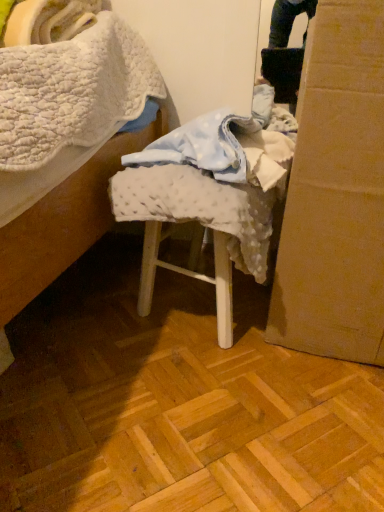
Question: Considering the relative positions of cardboard box at right and white dotted fabric at center in the image provided, is cardboard box at right behind white dotted fabric at center?

Choices:
 (A) no
 (B) yes

Answer: (A)

Question: From a real-world perspective, does cardboard box at right stand above white dotted fabric at center?

Choices:
 (A) no
 (B) yes

Answer: (B)

Question: Is cardboard box at right located outside white dotted fabric at center?

Choices:
 (A) no
 (B) yes

Answer: (B)

Question: From the image's perspective, is cardboard box at right beneath white dotted fabric at center?

Choices:
 (A) no
 (B) yes

Answer: (A)

Question: Does cardboard box at right come in front of white dotted fabric at center?

Choices:
 (A) yes
 (B) no

Answer: (A)

Question: From the image's perspective, is cardboard box at right on top of white dotted fabric at center?

Choices:
 (A) no
 (B) yes

Answer: (B)

Question: Is white dotted fabric at center surrounding cardboard box at right?

Choices:
 (A) no
 (B) yes

Answer: (A)

Question: Is white dotted fabric at center touching cardboard box at right?

Choices:
 (A) yes
 (B) no

Answer: (B)

Question: Can you confirm if white dotted fabric at center is smaller than cardboard box at right?

Choices:
 (A) yes
 (B) no

Answer: (A)

Question: From a real-world perspective, is white dotted fabric at center positioned under cardboard box at right based on gravity?

Choices:
 (A) yes
 (B) no

Answer: (A)

Question: From a real-world perspective, does white dotted fabric at center stand above cardboard box at right?

Choices:
 (A) yes
 (B) no

Answer: (B)

Question: Can you confirm if white dotted fabric at center is wider than cardboard box at right?

Choices:
 (A) no
 (B) yes

Answer: (A)

Question: Looking at their shapes, would you say white dotted fabric at center is wider or thinner than cardboard box at right?

Choices:
 (A) wide
 (B) thin

Answer: (B)